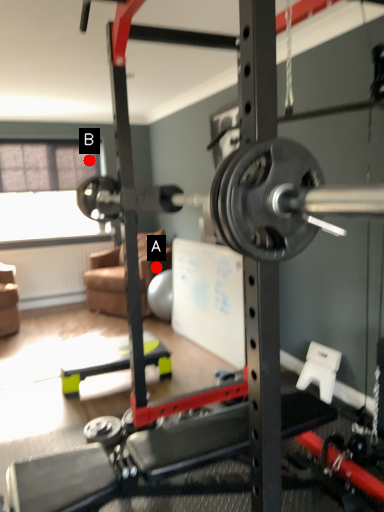
Question: Two points are circled on the image, labeled by A and B beside each circle. Which point appears farthest from the camera in this image?

Choices:
 (A) A is further
 (B) B is further

Answer: (B)